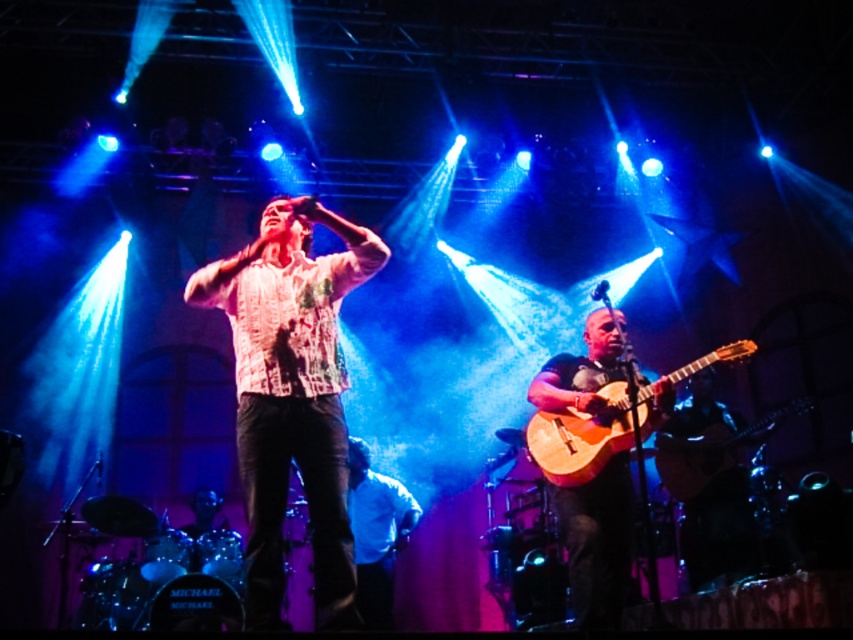
You are a photographer standing at the back of the venue and want to capture both the printed cotton shirt at center and the matte white shirt at center in the same frame. Your camera has a maximum focus range of 3 meters. Can you fit both shirts into the frame without moving closer?

The printed cotton shirt at center and the matte white shirt at center are 2.83 meters apart. Since the distance between them is less than the camera maximum focus range of 3 meters, you can fit both shirts into the frame without moving closer.

You are a photographer positioned at the back of the venue. You want to capture a photo of both the printed cotton shirt at center and the wooden acoustic guitar at center in the same frame. Based on their positions, which object should you focus on first to ensure both are in the frame?

The printed cotton shirt at center is to the left of the wooden acoustic guitar at center, so you should focus on the wooden acoustic guitar at center first to ensure both are in the frame.